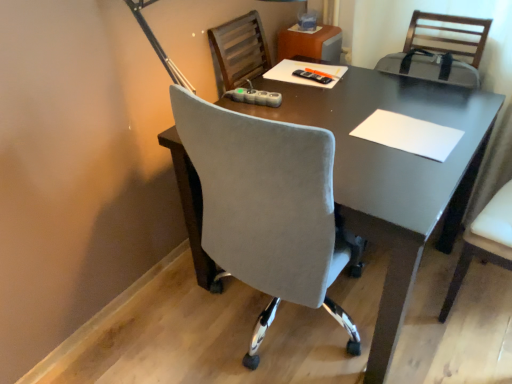
I want to click on free space between black plastic remote control at center and white paper at center, so click(355, 102).